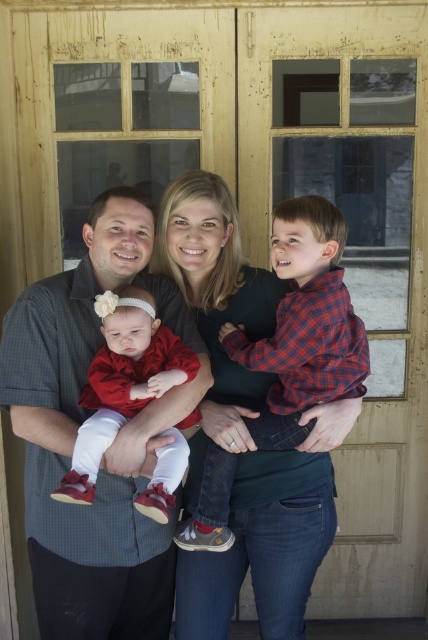
You are a delivery person trying to find the correct apartment. You see a family standing in front of a wooden door with glass panels. The man is holding a baby girl in red, and the woman is wearing a brushed metal shirt at center. There is a point at coordinates (76, 435). Can you tell me where exactly this point is located?

The point at coordinates (76, 435) is on the brushed metal shirt at center worn by the woman.

You are a photographer trying to capture a family portrait. You notice the brushed metal shirt at center and the matte red dress at center. Which clothing item is located to the left of the other?

The brushed metal shirt at center is positioned on the left side of matte red dress at center.

You are a photographer trying to capture the family in front of the wooden door. You notice the plaid cotton shirt at center and the matte red dress at center. Which clothing item is covering part of the other?

The plaid cotton shirt at center is positioned over the matte red dress at center, so it is covering part of it.